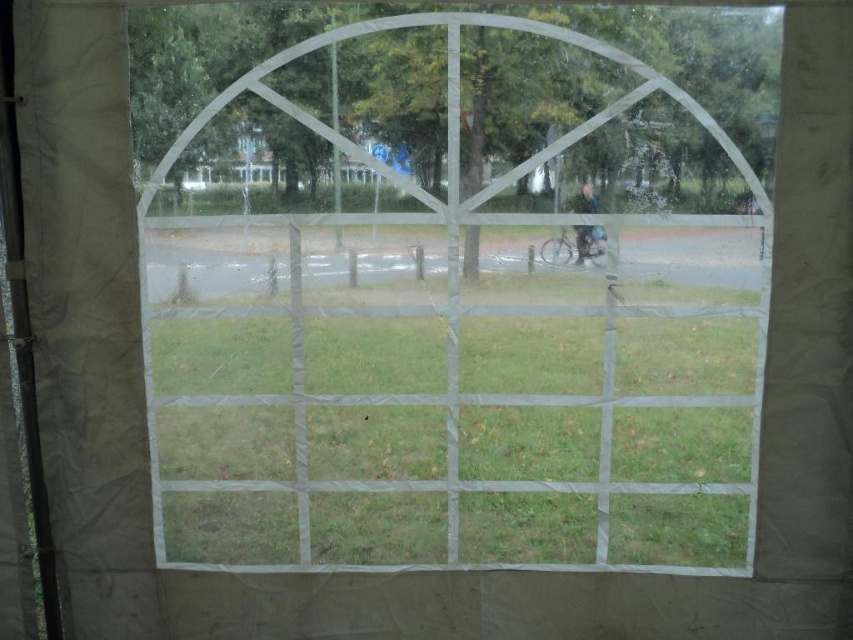
Question: Can you confirm if transparent plastic window at center is positioned to the left of green grass at center?

Choices:
 (A) yes
 (B) no

Answer: (B)

Question: Which of the following is the farthest from the observer?

Choices:
 (A) (230, 426)
 (B) (544, 388)

Answer: (A)

Question: Does transparent plastic window at center have a smaller size compared to green grass at center?

Choices:
 (A) yes
 (B) no

Answer: (B)

Question: Is transparent plastic window at center to the right of green grass at center from the viewer's perspective?

Choices:
 (A) no
 (B) yes

Answer: (B)

Question: Among these objects, which one is farthest from the camera?

Choices:
 (A) green grass at center
 (B) transparent plastic window at center

Answer: (A)